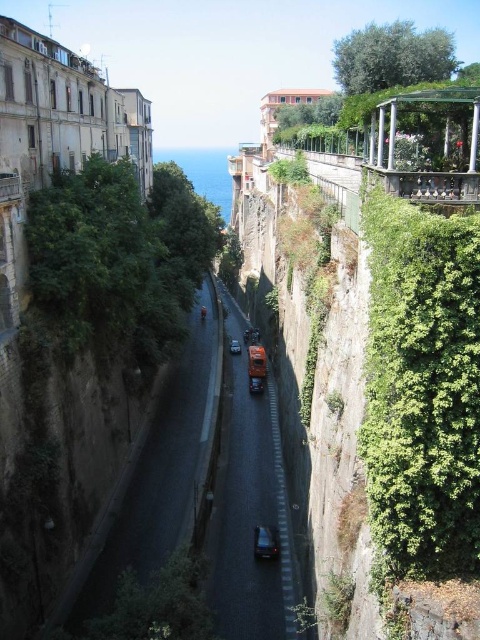
Describe the element at coordinates (249, 516) in the screenshot. I see `black asphalt road at center` at that location.

Between point (230, 397) and point (261, 544), which one is positioned in front?

Point (261, 544) is more forward.

Where is `black asphalt road at center`? This screenshot has height=640, width=480. black asphalt road at center is located at coordinates (249, 516).

Does point (230, 627) lie in front of point (285, 579)?

Yes, it is.

Which is in front, point (110, 534) or point (225, 612)?

Point (225, 612)

Locate an element on the screen. The image size is (480, 640). dark asphalt road at center is located at coordinates (202, 500).

Is point (274, 392) closer to camera compared to point (252, 394)?

That is False.

Between black asphalt road at center and metallic silver car at center, which one has more height?

black asphalt road at center

Locate an element on the screen. Image resolution: width=480 pixels, height=640 pixels. black asphalt road at center is located at coordinates (249, 516).